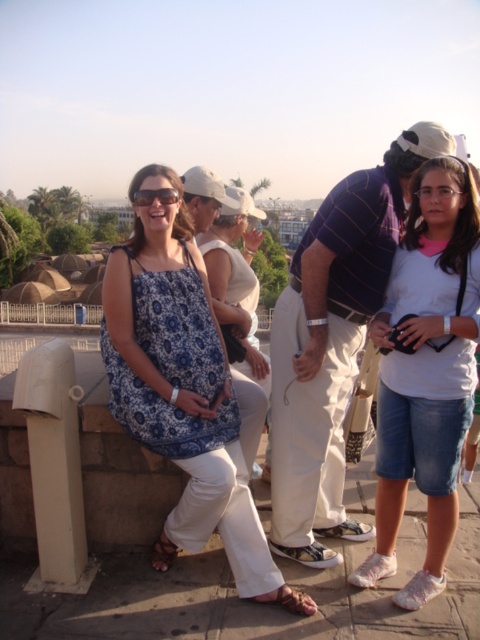
Based on the scene description, where is the striped cotton shirt at center located in the image?

The striped cotton shirt at center is located at point (333, 342) in the image.